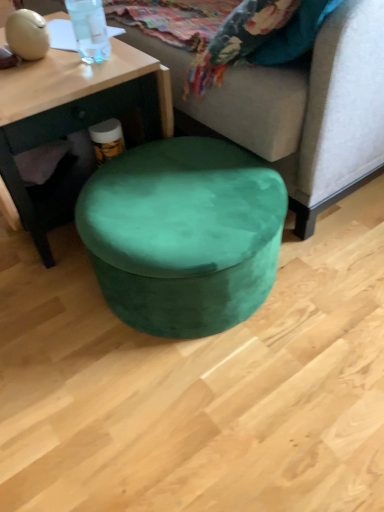
Question: Is matte wood coffee table at center far from transparent plastic bottle at upper left?

Choices:
 (A) yes
 (B) no

Answer: (B)

Question: Does matte wood coffee table at center contain transparent plastic bottle at upper left?

Choices:
 (A) no
 (B) yes

Answer: (A)

Question: Does matte wood coffee table at center have a lesser height compared to transparent plastic bottle at upper left?

Choices:
 (A) no
 (B) yes

Answer: (A)

Question: Is matte wood coffee table at center wider than transparent plastic bottle at upper left?

Choices:
 (A) yes
 (B) no

Answer: (A)

Question: Can we say matte wood coffee table at center lies outside transparent plastic bottle at upper left?

Choices:
 (A) yes
 (B) no

Answer: (A)

Question: Is matte wood coffee table at center smaller than transparent plastic bottle at upper left?

Choices:
 (A) no
 (B) yes

Answer: (A)

Question: Is transparent plastic bottle at upper left closer to the viewer compared to velvet green ottoman at center?

Choices:
 (A) yes
 (B) no

Answer: (B)

Question: Considering the relative sizes of transparent plastic bottle at upper left and velvet green ottoman at center in the image provided, is transparent plastic bottle at upper left wider than velvet green ottoman at center?

Choices:
 (A) yes
 (B) no

Answer: (B)

Question: From the image's perspective, does transparent plastic bottle at upper left appear higher than velvet green ottoman at center?

Choices:
 (A) yes
 (B) no

Answer: (A)

Question: Does transparent plastic bottle at upper left have a greater height compared to velvet green ottoman at center?

Choices:
 (A) no
 (B) yes

Answer: (B)

Question: From the image's perspective, is transparent plastic bottle at upper left below velvet green ottoman at center?

Choices:
 (A) no
 (B) yes

Answer: (A)

Question: Is transparent plastic bottle at upper left bigger than velvet green ottoman at center?

Choices:
 (A) no
 (B) yes

Answer: (A)

Question: From the image's perspective, is matte wood coffee table at center beneath velvet green ottoman at center?

Choices:
 (A) yes
 (B) no

Answer: (A)